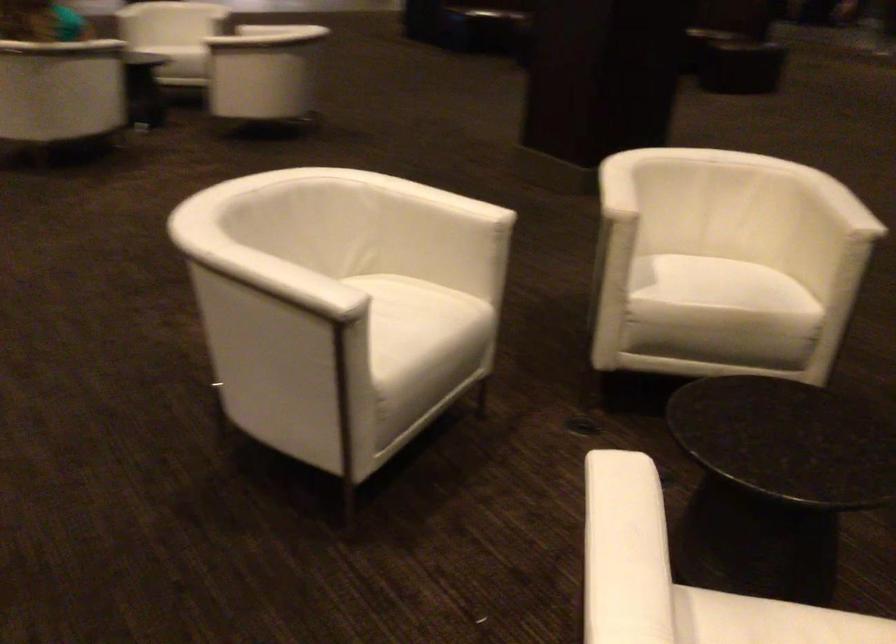
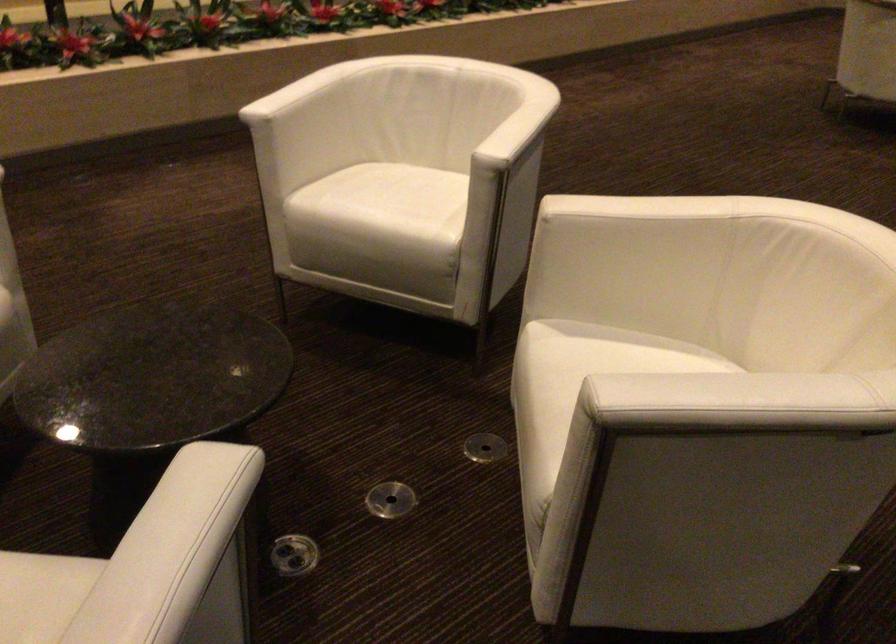
Where in the second image is the point corresponding to the point at 587,426 from the first image?

(484, 447)